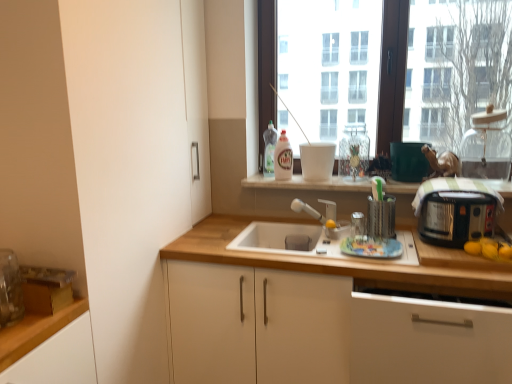
Question: Is white matte countertop at center wider or thinner than clear plastic utensil holder at upper right, the 4th appliance when ordered from right to left?

Choices:
 (A) thin
 (B) wide

Answer: (B)

Question: Is white matte countertop at center to the left or to the right of clear plastic utensil holder at upper right, arranged as the second appliance when viewed from the left, in the image?

Choices:
 (A) right
 (B) left

Answer: (A)

Question: Which object is positioned closest to the white matte countertop at center?

Choices:
 (A) transparent glass window at center
 (B) white matte cabinet at lower right, which is the first cabinetry from right to left
 (C) white matte cabinet at center, marked as the second cabinetry in a right-to-left arrangement
 (D) translucent plastic bottle at upper center, arranged as the 1th bottle when viewed from the back
 (E) transparent glass jar at upper right, arranged as the first appliance when viewed from the right

Answer: (D)

Question: Which of these objects is positioned farthest from the white glossy bottle at center, positioned as the second bottle in back-to-front order?

Choices:
 (A) white matte cabinet at center, marked as the second cabinetry in a right-to-left arrangement
 (B) transparent glass jar at upper right, arranged as the first appliance when viewed from the right
 (C) translucent plastic bottle at upper center, the second bottle from the front
 (D) white matte countertop at center
 (E) black plastic toaster at right, the 2th appliance when ordered from right to left

Answer: (B)